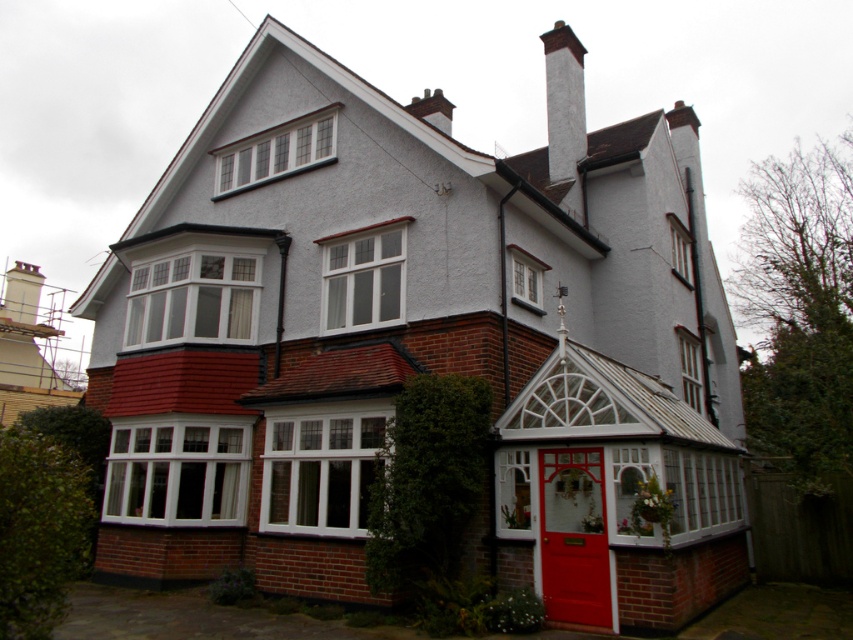
You are standing in front of the house and want to locate the white glass conservatory at center. Based on the coordinates provided, where should you look relative to the house?

The white glass conservatory at center is located at coordinates point (x=618, y=492), which means it is positioned towards the lower right section of the house.

In the scene shown: You are a delivery person approaching the house and need to locate the front door. You see the white glass conservatory at center and the white smooth chimney at upper center. Which object is closer to the ground?

The white glass conservatory at center is located below the white smooth chimney at upper center, so it is closer to the ground.

You are standing in front of the house and want to place a decorative wreath on one of the two points mentioned. The first point is at coordinates point (643, 624) and the second is at point (561, 156). Which point is closer to you so that you can easily reach it without needing a ladder?

Point (643, 624) is closer to the viewer than point (561, 156), so you can easily reach it without needing a ladder.